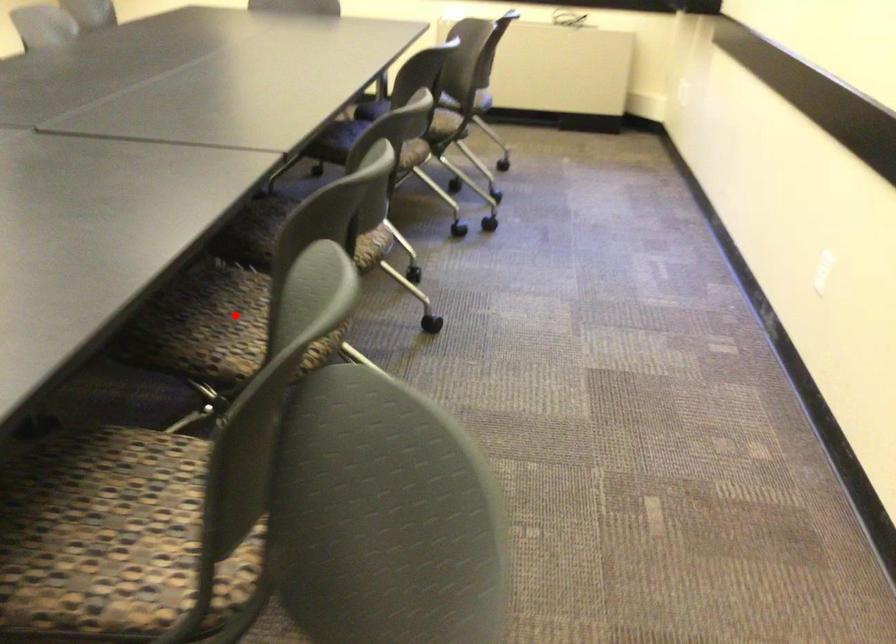
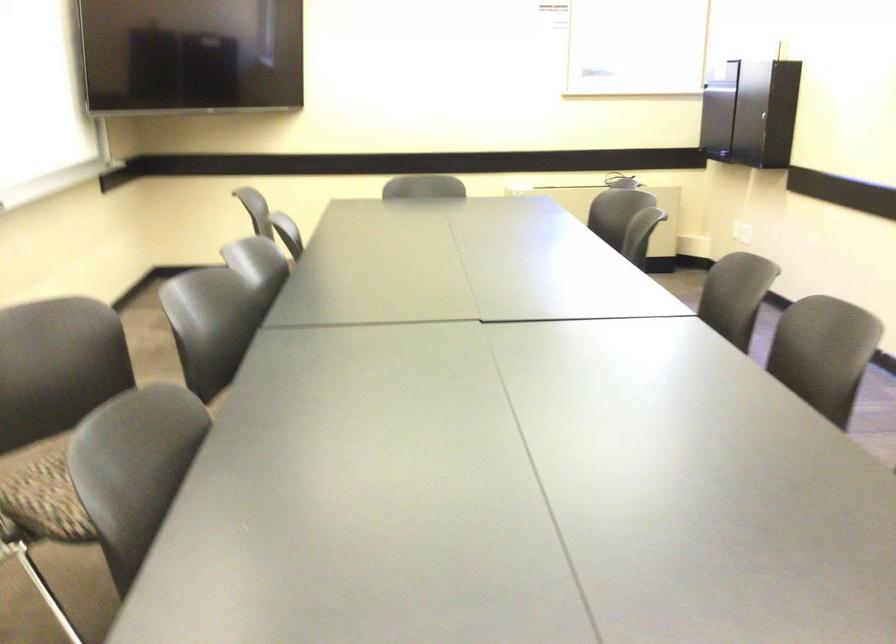
Question: I am providing you with two images of the same scene from different viewpoints. A red point is marked on the first image. Can you still see the location of the red point in image 2?

Choices:
 (A) Yes
 (B) No

Answer: (B)